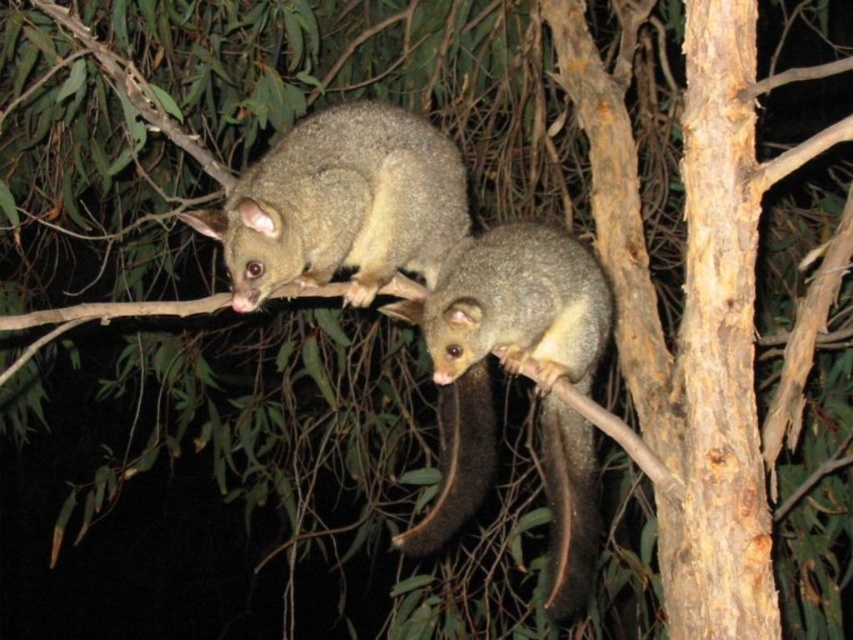
You are a wildlife photographer aiming to capture both the fuzzy gray possum at upper center and the brown furry tail at lower center in a single frame. Given their distance apart, what is the minimum focal length you should use to ensure both are in focus?

The fuzzy gray possum at upper center and the brown furry tail at lower center are 25.44 inches apart. To capture both in focus, you should use a focal length that allows for a depth of field sufficient to cover this distance, typically requiring a shorter focal length lens.

You are a wildlife photographer trying to capture a photo of the fuzzy gray possum at upper center. You notice that the point representing its location is at coordinates point (341, 205). Based on this information, can you estimate where the fuzzy gray possum at upper center is located in the image?

The fuzzy gray possum at upper center is located at the coordinates point (341, 205), which places it in the upper center of the image.